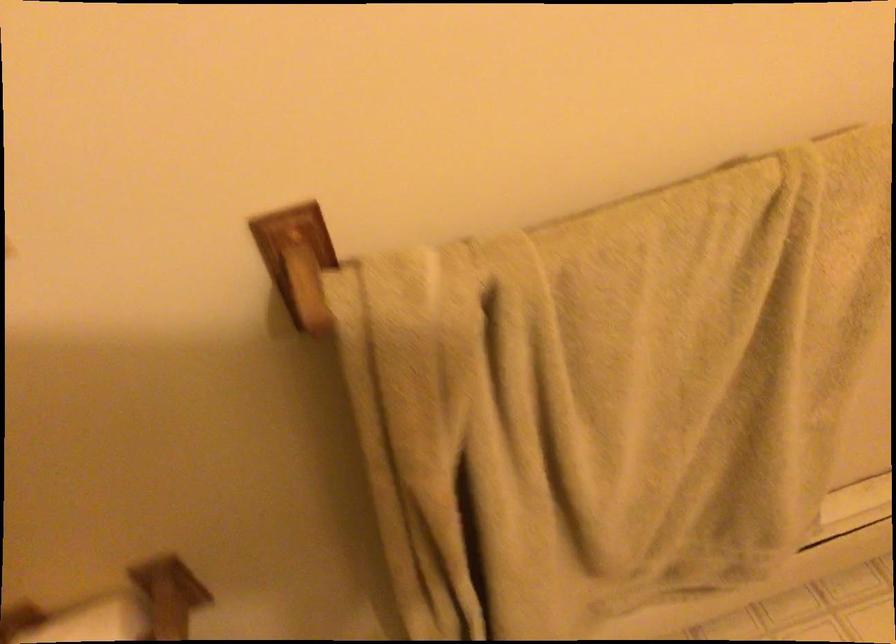
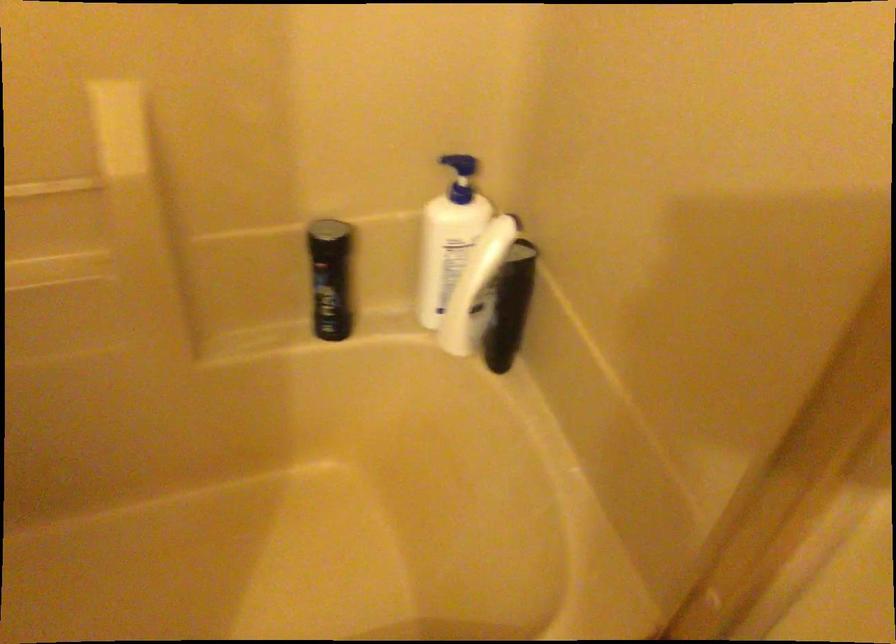
How did the camera likely rotate?

The rotation direction of the camera is left-down.